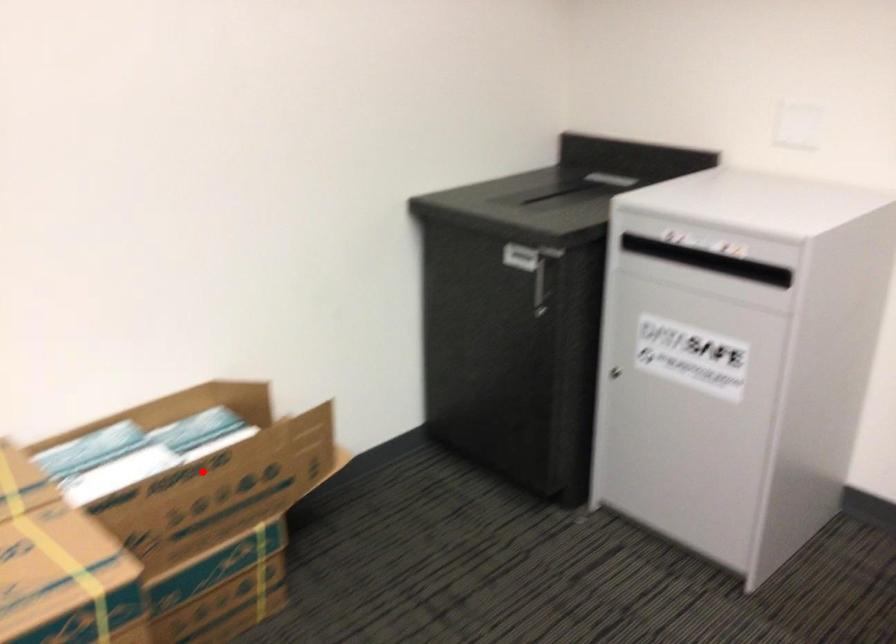
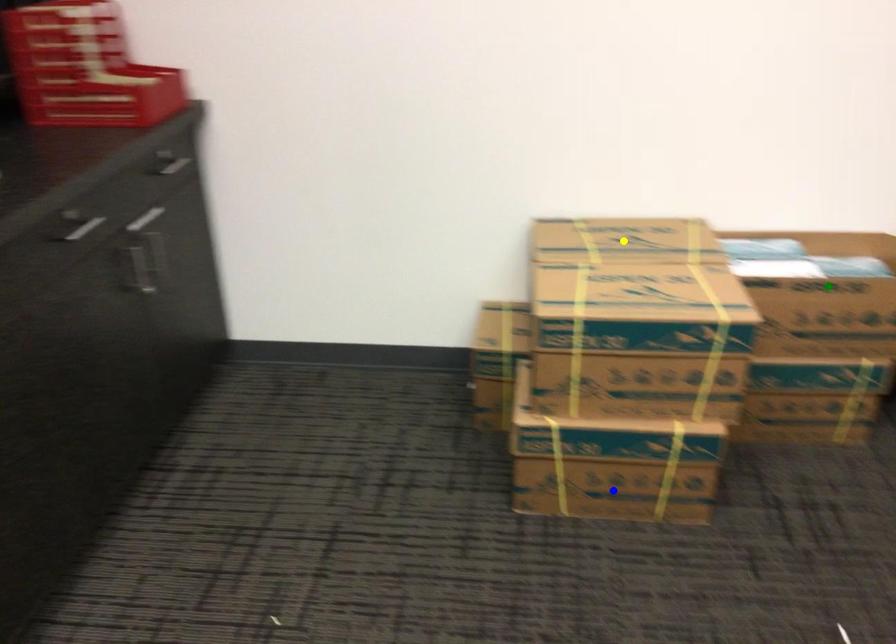
Question: I am providing you with two images of the same scene from different viewpoints. A red point is marked on the first image. You are given multiple points on the second image. Which point in image 2 is actually the same real-world point as the red point in image 1?

Choices:
 (A) blue point
 (B) yellow point
 (C) green point

Answer: (C)